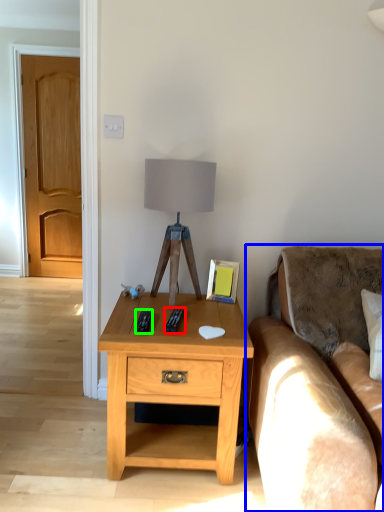
Question: Which object is the farthest from remote (highlighted by a red box)? Choose among these: studio couch (highlighted by a blue box) or remote (highlighted by a green box).

Choices:
 (A) studio couch
 (B) remote

Answer: (A)